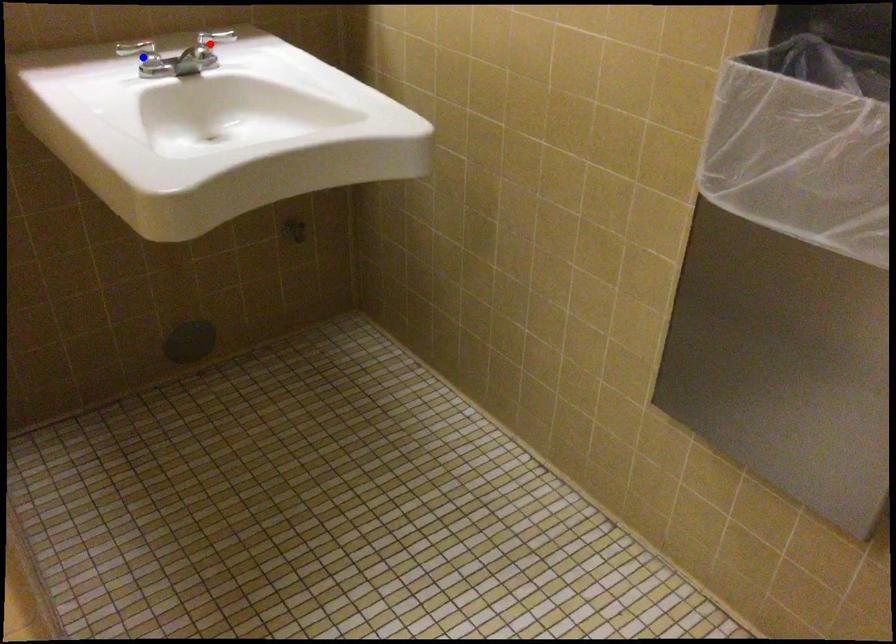
Question: Two points are marked on the image. Which point is closer to the camera?

Choices:
 (A) Blue point is closer.
 (B) Red point is closer.

Answer: (A)